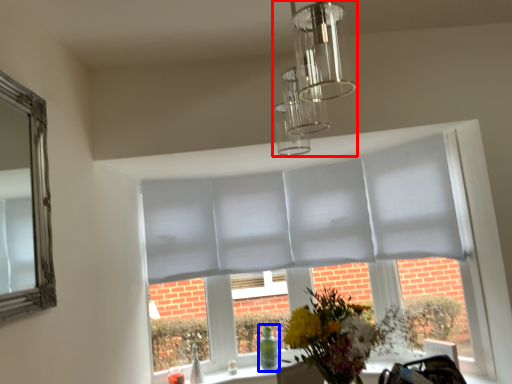
Question: Which point is closer to the camera, light fixture (highlighted by a red box) or glass vase (highlighted by a blue box)?

Choices:
 (A) light fixture
 (B) glass vase

Answer: (A)